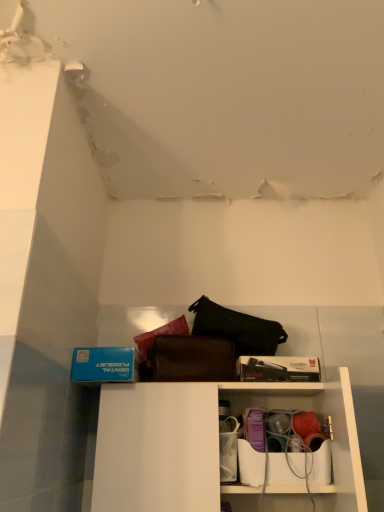
Question: Considering the relative positions of white plastic shelf at lower center and matte plastic container at lower center in the image provided, is white plastic shelf at lower center behind matte plastic container at lower center?

Choices:
 (A) yes
 (B) no

Answer: (B)

Question: Would you say white plastic shelf at lower center is outside matte plastic container at lower center?

Choices:
 (A) yes
 (B) no

Answer: (A)

Question: From the image's perspective, is white plastic shelf at lower center beneath matte plastic container at lower center?

Choices:
 (A) no
 (B) yes

Answer: (A)

Question: Can matte plastic container at lower center be found inside white plastic shelf at lower center?

Choices:
 (A) yes
 (B) no

Answer: (A)

Question: Does white plastic shelf at lower center turn towards matte plastic container at lower center?

Choices:
 (A) no
 (B) yes

Answer: (A)

Question: Does white plastic shelf at lower center lie in front of matte plastic container at lower center?

Choices:
 (A) yes
 (B) no

Answer: (A)

Question: Can you confirm if matte plastic container at lower center is shorter than white plastic shelf at lower center?

Choices:
 (A) yes
 (B) no

Answer: (A)

Question: Is matte plastic container at lower center far away from white plastic shelf at lower center?

Choices:
 (A) yes
 (B) no

Answer: (B)

Question: Does matte plastic container at lower center have a larger size compared to white plastic shelf at lower center?

Choices:
 (A) yes
 (B) no

Answer: (B)

Question: Does matte plastic container at lower center lie in front of white plastic shelf at lower center?

Choices:
 (A) no
 (B) yes

Answer: (A)

Question: From a real-world perspective, is matte plastic container at lower center located higher than white plastic shelf at lower center?

Choices:
 (A) yes
 (B) no

Answer: (B)

Question: Is matte plastic container at lower center to the right of white plastic shelf at lower center from the viewer's perspective?

Choices:
 (A) yes
 (B) no

Answer: (A)

Question: In terms of size, does matte plastic container at lower center appear bigger or smaller than white plastic shelf at lower center?

Choices:
 (A) big
 (B) small

Answer: (B)